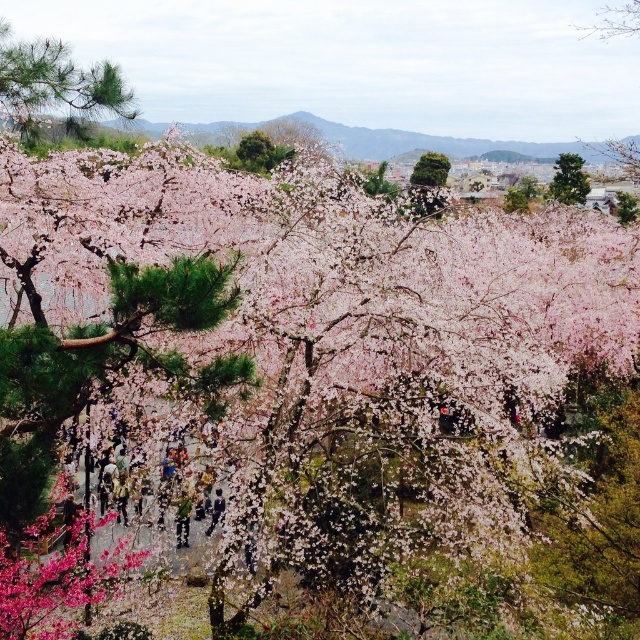
You are standing on the pathway and want to take a photo of both the green textured pine tree at upper right and the green leafy tree at center. Which tree should you focus on first to ensure both are in the frame?

You should focus on the green textured pine tree at upper right first because it is closer to you than the green leafy tree at center, so adjusting the camera to include it will also capture the farther tree.

You are standing in a cherry blossom garden and see a point marked at coordinates (56, 86). What object does this point correspond to?

The point at coordinates (56, 86) corresponds to the green matte pine tree at upper left.

You are planning to place a new bench in this cherry blossom garden. The bench needs to be positioned so that it is between the green matte pine tree at upper left and the green fabric person at center. Considering their sizes, which object should the bench be closer to?

The bench should be closer to the green matte pine tree at upper left because it is smaller than the green fabric person at center, allowing for better spatial balance.